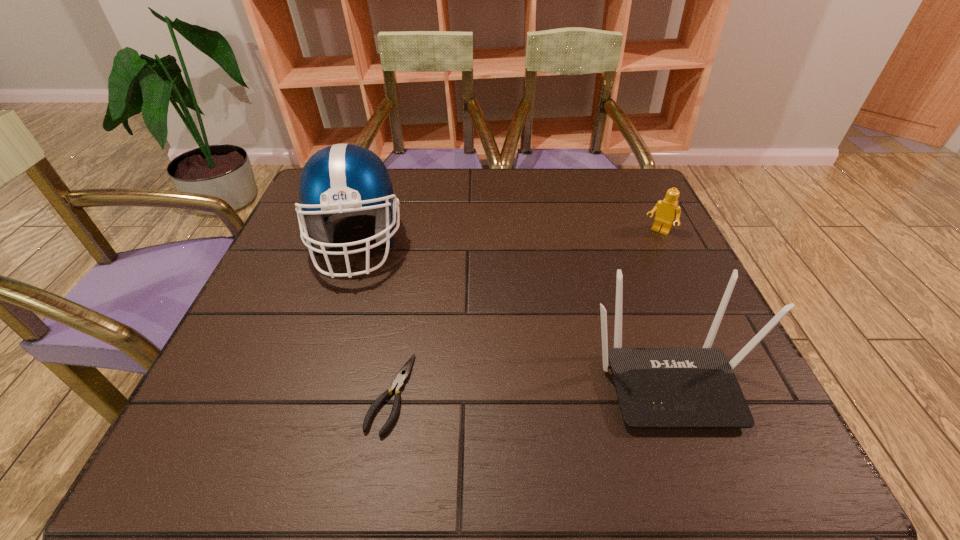
Where is `vacant space situated on the face of the Lego`? Image resolution: width=960 pixels, height=540 pixels. vacant space situated on the face of the Lego is located at coordinates (600, 313).

Image resolution: width=960 pixels, height=540 pixels. I want to click on object at the far edge, so click(x=343, y=180).

I want to click on pliers present at the near edge, so click(403, 374).

Locate an element on the screen. This screenshot has width=960, height=540. router positioned at the near edge is located at coordinates (656, 387).

The image size is (960, 540). Find the location of `object positioned at the left edge`. object positioned at the left edge is located at coordinates (343, 180).

Find the location of a particular element. router that is at the right edge is located at coordinates (656, 387).

Where is `Lego located in the right edge section of the desktop`? Lego located in the right edge section of the desktop is located at coordinates (668, 209).

Locate an element on the screen. The width and height of the screenshot is (960, 540). object that is at the far left corner is located at coordinates (343, 180).

Identify the location of object located in the near right corner section of the desktop. The image size is (960, 540). (x=656, y=387).

In the image, there is a desktop. In order to click on vacant region at the far edge in this screenshot , I will do `click(540, 169)`.